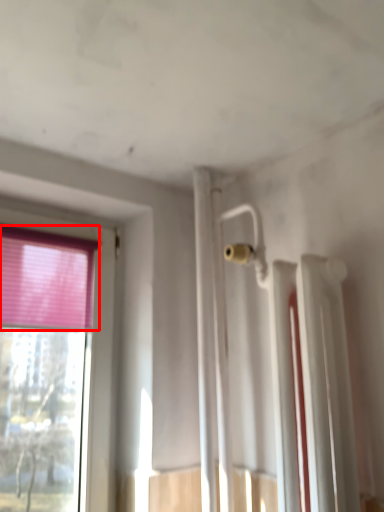
Question: From the image, what is the correct spatial relationship of curtain (annotated by the red box) in relation to radiator?

Choices:
 (A) left
 (B) right

Answer: (A)